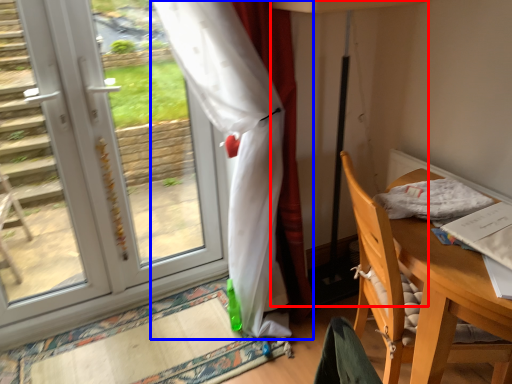
Question: Which of the following is the farthest to the observer, table lamp (highlighted by a red box) or curtain (highlighted by a blue box)?

Choices:
 (A) table lamp
 (B) curtain

Answer: (A)